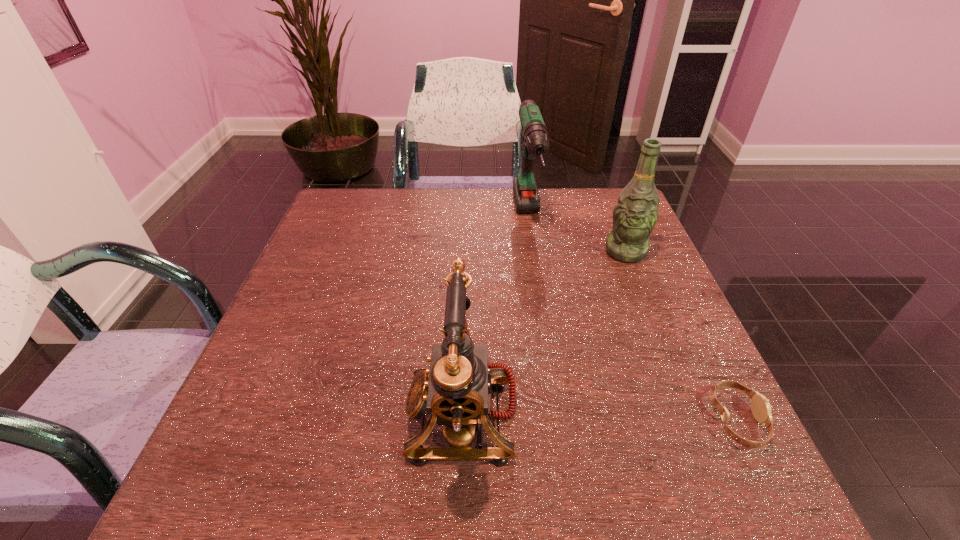
In the image, there is a desktop. What are the coordinates of `vacant space at the near edge` in the screenshot? It's located at (582, 415).

Locate an element on the screen. The width and height of the screenshot is (960, 540). vacant point at the left edge is located at coordinates (325, 262).

In the image, there is a desktop. Where is `free space at the right edge`? Image resolution: width=960 pixels, height=540 pixels. free space at the right edge is located at coordinates (682, 331).

Image resolution: width=960 pixels, height=540 pixels. In the image, there is a desktop. In order to click on vacant region at the far right corner in this screenshot , I will do `click(612, 220)`.

Locate an element on the screen. free spot at the near right corner of the desktop is located at coordinates (731, 441).

Locate an element on the screen. vacant space in between the beer bottle and the third object from right to left is located at coordinates (577, 235).

I want to click on free point between the telephone and the drill, so click(495, 317).

Where is `free area in between the watch and the drill`? free area in between the watch and the drill is located at coordinates (633, 320).

This screenshot has width=960, height=540. Find the location of `vacant area between the second object from left to right and the beer bottle`. vacant area between the second object from left to right and the beer bottle is located at coordinates (577, 235).

Identify the location of empty space that is in between the leftmost object and the shortest object. (600, 417).